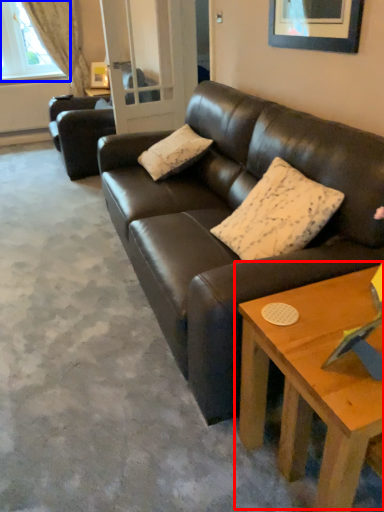
Question: Which point is further to the camera, coffee table (highlighted by a red box) or window (highlighted by a blue box)?

Choices:
 (A) coffee table
 (B) window

Answer: (B)